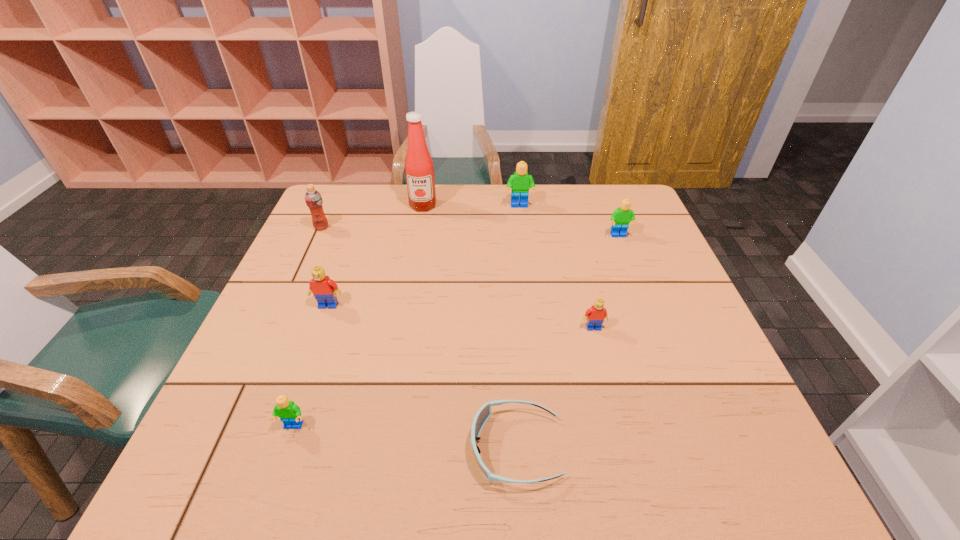
Locate which Lego ranks fifth in proximity to the shortest object. Please provide its 2D coordinates. Your answer should be formatted as a tuple, i.e. [(x, y)], where the tuple contains the x and y coordinates of a point satisfying the conditions above.

[(520, 182)]

At what (x,y) coordinates should I click in order to perform the action: click on the closest green Lego to the second nearest green Lego. Please return your answer as a coordinate pair (x, y). Image resolution: width=960 pixels, height=540 pixels. Looking at the image, I should click on (520, 182).

Locate which green Lego is the third closest to the seventh object from left to right. Please provide its 2D coordinates. Your answer should be formatted as a tuple, i.e. [(x, y)], where the tuple contains the x and y coordinates of a point satisfying the conditions above.

[(290, 414)]